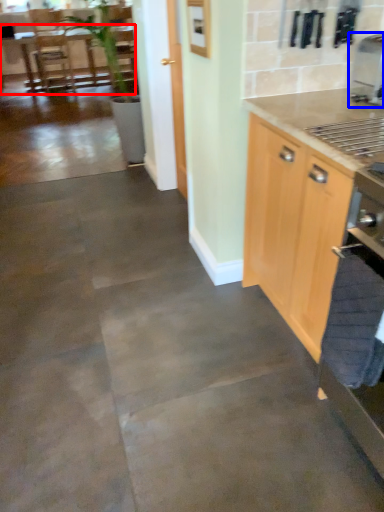
Question: Among these objects, which one is farthest to the camera, table (highlighted by a red box) or coffee machine (highlighted by a blue box)?

Choices:
 (A) table
 (B) coffee machine

Answer: (A)